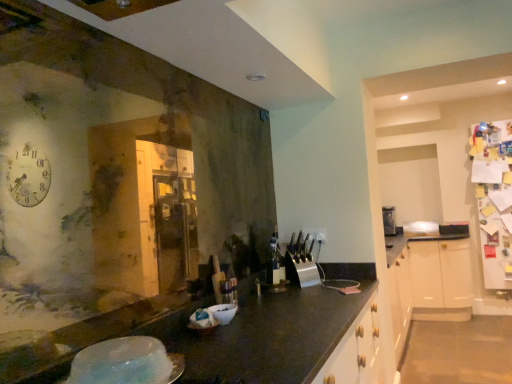
Question: Looking at the image, does white glossy bowl at center seem bigger or smaller compared to translucent plastic bowl at lower left?

Choices:
 (A) small
 (B) big

Answer: (A)

Question: From the image's perspective, is white glossy bowl at center above or below translucent plastic bowl at lower left?

Choices:
 (A) above
 (B) below

Answer: (B)

Question: Considering the positions of point (226, 311) and point (135, 380), is point (226, 311) closer or farther from the camera than point (135, 380)?

Choices:
 (A) farther
 (B) closer

Answer: (A)

Question: In terms of height, does translucent plastic bowl at lower left look taller or shorter compared to white glossy bowl at center?

Choices:
 (A) tall
 (B) short

Answer: (B)

Question: Relative to white glossy bowl at center, is translucent plastic bowl at lower left in front or behind?

Choices:
 (A) front
 (B) behind

Answer: (A)

Question: Looking at the image, does translucent plastic bowl at lower left seem bigger or smaller compared to white glossy bowl at center?

Choices:
 (A) small
 (B) big

Answer: (B)

Question: Considering the positions of translucent plastic bowl at lower left and white glossy bowl at center in the image, is translucent plastic bowl at lower left wider or thinner than white glossy bowl at center?

Choices:
 (A) thin
 (B) wide

Answer: (B)